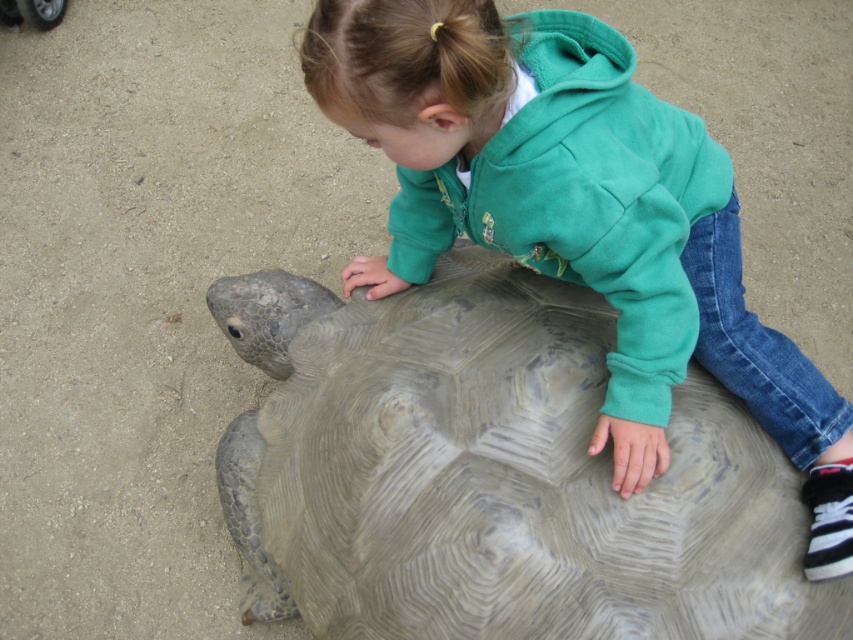
You are a zookeeper standing at the camera position. You need to reach the gray textured shell at center to feed the tortoise. Can you comfortably reach it without moving closer than 4 feet?

The gray textured shell at center is 4.34 feet away from the camera, so you can comfortably reach it without moving closer than 4 feet since the distance is slightly more than 4 feet.

You are a zookeeper who needs to ensure the safety of the tortoise and the child. The gray textured shell at center belongs to the tortoise, and the green fleece jacket at upper center is worn by the child. Based on their sizes, which one is more likely to be able to move away quickly if needed?

The gray textured shell at center is smaller than the green fleece jacket at upper center, so the tortoise with the gray textured shell at center is smaller and likely less capable of moving quickly compared to the child wearing the green fleece jacket at upper center.